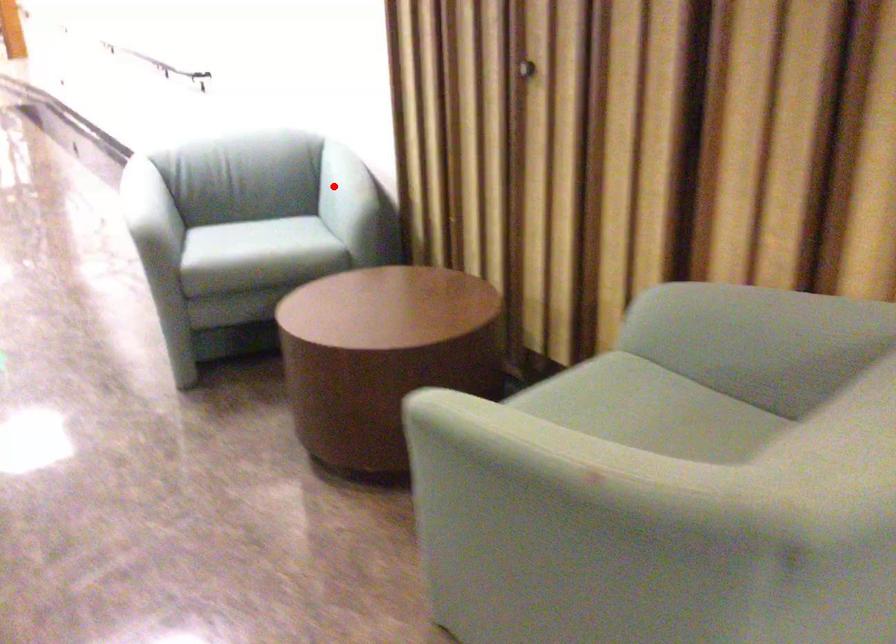
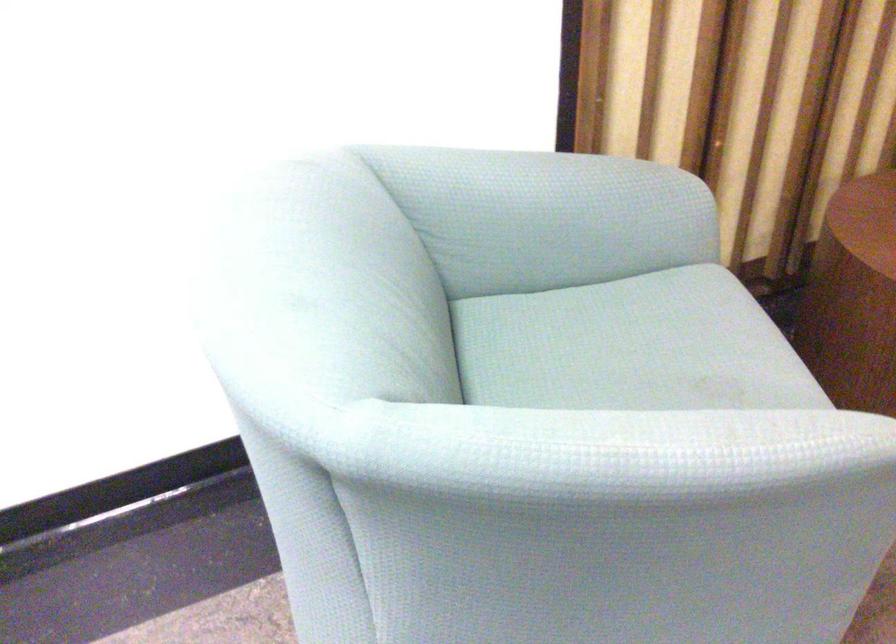
Question: I am providing you with two images of the same scene from different viewpoints. Image1 has a red point marked. In image2, the corresponding 3D location appears at what relative position? Reply with the corresponding letter.

Choices:
 (A) Closer
 (B) Farther

Answer: (A)